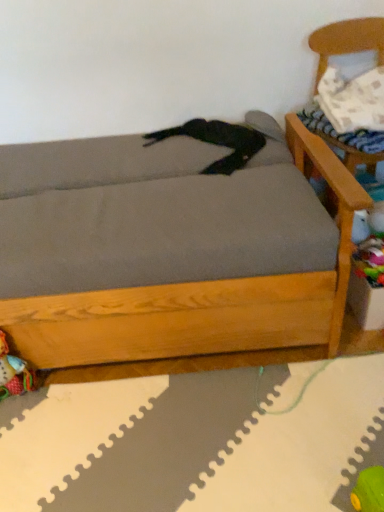
Question: Considering the relative sizes of wooden armchair at upper right and white textured pillow at upper right in the image provided, is wooden armchair at upper right taller than white textured pillow at upper right?

Choices:
 (A) yes
 (B) no

Answer: (A)

Question: Is wooden armchair at upper right turned away from white textured pillow at upper right?

Choices:
 (A) yes
 (B) no

Answer: (A)

Question: Can you confirm if wooden armchair at upper right is bigger than white textured pillow at upper right?

Choices:
 (A) yes
 (B) no

Answer: (A)

Question: Is wooden armchair at upper right outside white textured pillow at upper right?

Choices:
 (A) no
 (B) yes

Answer: (B)

Question: From a real-world perspective, is wooden armchair at upper right positioned under white textured pillow at upper right based on gravity?

Choices:
 (A) yes
 (B) no

Answer: (A)

Question: Is multicolored fabric toy at lower left, marked as the 2th toy in a top-to-bottom arrangement, situated inside wooden armchair at upper right or outside?

Choices:
 (A) inside
 (B) outside

Answer: (B)

Question: From a real-world perspective, relative to wooden armchair at upper right, is multicolored fabric toy at lower left, marked as the 2th toy in a top-to-bottom arrangement, vertically above or below?

Choices:
 (A) below
 (B) above

Answer: (A)

Question: From the image's perspective, is multicolored fabric toy at lower left, the 1th toy positioned from the left, located above or below wooden armchair at upper right?

Choices:
 (A) below
 (B) above

Answer: (A)

Question: Considering the positions of multicolored fabric toy at lower left, the 2th toy positioned from the right, and wooden armchair at upper right in the image, is multicolored fabric toy at lower left, the 2th toy positioned from the right, bigger or smaller than wooden armchair at upper right?

Choices:
 (A) big
 (B) small

Answer: (B)

Question: Considering their positions, is white textured pillow at upper right located in front of or behind multicolored plastic toy at lower right, which appears as the second toy when viewed from the left?

Choices:
 (A) behind
 (B) front

Answer: (A)

Question: From a real-world perspective, is white textured pillow at upper right physically located above or below multicolored plastic toy at lower right, the 2th toy positioned from the bottom?

Choices:
 (A) above
 (B) below

Answer: (A)

Question: Is point (370, 95) closer or farther from the camera than point (372, 249)?

Choices:
 (A) closer
 (B) farther

Answer: (B)

Question: In terms of width, does white textured pillow at upper right look wider or thinner when compared to multicolored plastic toy at lower right, the 2th toy positioned from the bottom?

Choices:
 (A) wide
 (B) thin

Answer: (A)

Question: From their relative heights in the image, would you say gray fabric studio couch at center is taller or shorter than multicolored plastic toy at lower right, which is the 1th toy in right-to-left order?

Choices:
 (A) short
 (B) tall

Answer: (B)

Question: Is gray fabric studio couch at center bigger or smaller than multicolored plastic toy at lower right, the 2th toy positioned from the bottom?

Choices:
 (A) small
 (B) big

Answer: (B)